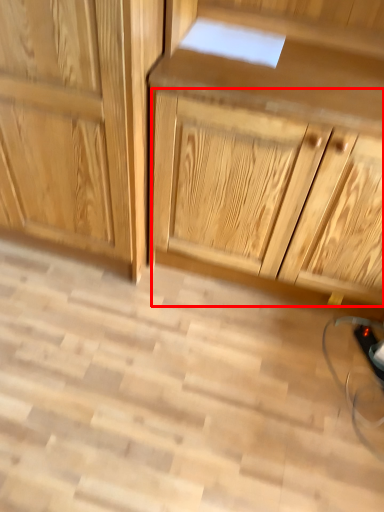
Question: From the image's perspective, considering the relative positions of drawer (annotated by the red box) and cabinetry in the image provided, where is drawer (annotated by the red box) located with respect to the staircase?

Choices:
 (A) above
 (B) below

Answer: (B)